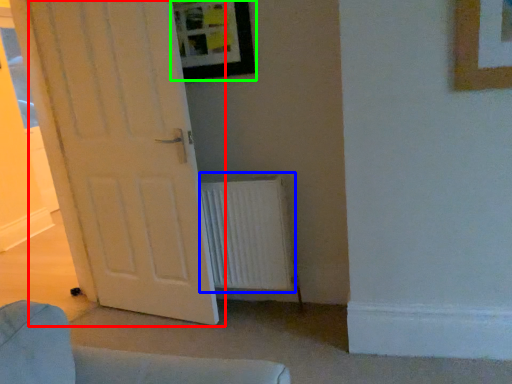
Question: Considering the real-world distances, which object is farthest from door (highlighted by a red box)? radiator (highlighted by a blue box) or picture frame (highlighted by a green box)?

Choices:
 (A) radiator
 (B) picture frame

Answer: (B)